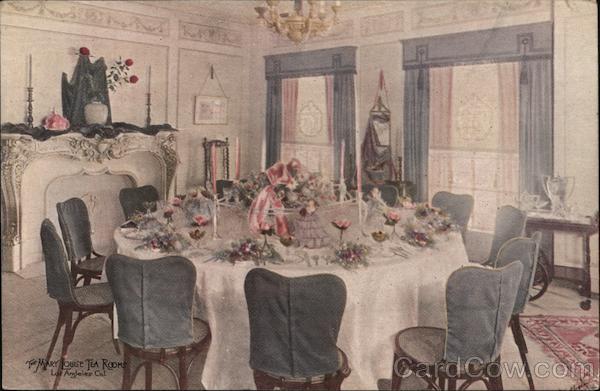
At what (x,y) coordinates should I click in order to perform the action: click on taper candle. Please return your answer as a coordinate pair (x, y). The width and height of the screenshot is (600, 391). Looking at the image, I should click on (216, 189).